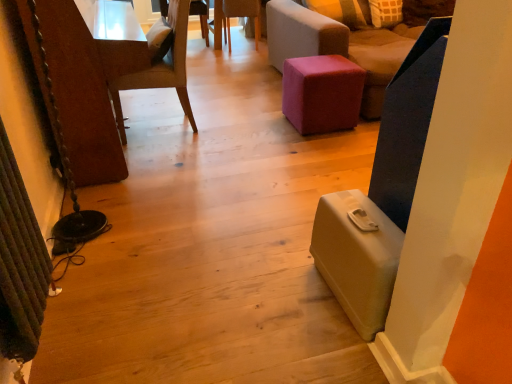
Question: Is velvet pink ottoman at center oriented towards purple fabric ottoman at center, the first chair when ordered from right to left?

Choices:
 (A) yes
 (B) no

Answer: (A)

Question: Is purple fabric ottoman at center, the first chair when ordered from right to left, surrounded by velvet pink ottoman at center?

Choices:
 (A) yes
 (B) no

Answer: (B)

Question: Does velvet pink ottoman at center have a lesser width compared to purple fabric ottoman at center, which ranks as the 4th chair in left-to-right order?

Choices:
 (A) no
 (B) yes

Answer: (B)

Question: From a real-world perspective, is velvet pink ottoman at center physically above purple fabric ottoman at center, the first chair when ordered from right to left?

Choices:
 (A) no
 (B) yes

Answer: (A)

Question: Can you confirm if velvet pink ottoman at center is taller than purple fabric ottoman at center, the first chair when ordered from right to left?

Choices:
 (A) yes
 (B) no

Answer: (B)

Question: Relative to purple fabric ottoman at center, which ranks as the 4th chair in left-to-right order, is matte green suitcase at lower right in front or behind?

Choices:
 (A) behind
 (B) front

Answer: (B)

Question: Would you say matte green suitcase at lower right is inside or outside purple fabric ottoman at center, the first chair when ordered from right to left?

Choices:
 (A) inside
 (B) outside

Answer: (B)

Question: Based on their positions, is matte green suitcase at lower right located to the left or right of purple fabric ottoman at center, which ranks as the 4th chair in left-to-right order?

Choices:
 (A) left
 (B) right

Answer: (A)

Question: Looking at their shapes, would you say matte green suitcase at lower right is wider or thinner than purple fabric ottoman at center, the first chair when ordered from right to left?

Choices:
 (A) wide
 (B) thin

Answer: (B)

Question: Considering their positions, is light brown wood chair at left, placed as the 2th chair when sorted from left to right, located in front of or behind wooden textured chair at upper center, which is the first chair from left to right?

Choices:
 (A) behind
 (B) front

Answer: (B)

Question: Looking at their shapes, would you say light brown wood chair at left, placed as the 2th chair when sorted from left to right, is wider or thinner than wooden textured chair at upper center, which is the first chair from left to right?

Choices:
 (A) thin
 (B) wide

Answer: (A)

Question: Is point (180, 92) positioned closer to the camera than point (202, 3)?

Choices:
 (A) farther
 (B) closer

Answer: (B)

Question: Which is correct: light brown wood chair at left, positioned as the third chair in right-to-left order, is inside wooden textured chair at upper center, which is counted as the fourth chair, starting from the right, or outside of it?

Choices:
 (A) inside
 (B) outside

Answer: (B)

Question: From the image's perspective, relative to wooden chair at center, acting as the third chair starting from the left, is matte green suitcase at lower right above or below?

Choices:
 (A) below
 (B) above

Answer: (A)

Question: Is matte green suitcase at lower right wider or thinner than wooden chair at center, arranged as the second chair when viewed from the right?

Choices:
 (A) thin
 (B) wide

Answer: (A)